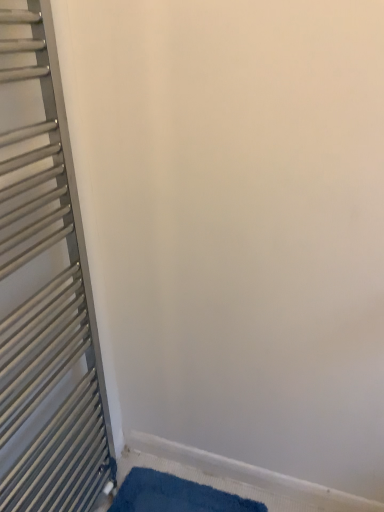
I want to click on brushed metal radiator at left, so click(44, 289).

Image resolution: width=384 pixels, height=512 pixels. What do you see at coordinates (44, 289) in the screenshot?
I see `brushed metal radiator at left` at bounding box center [44, 289].

You are a GUI agent. You are given a task and a screenshot of the screen. Output one action in this format:
    pyautogui.click(x=<x>, y=<y>)
    Task: Click on the brushed metal radiator at left
    Image resolution: width=384 pixels, height=512 pixels.
    Given the screenshot: What is the action you would take?
    pyautogui.click(x=44, y=289)